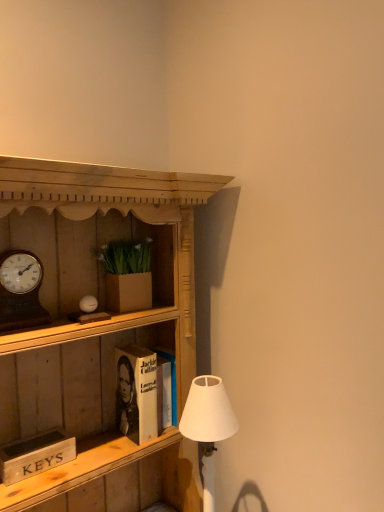
Question: Is brown cardboard box at upper center shorter than wooden cabinet at center?

Choices:
 (A) yes
 (B) no

Answer: (A)

Question: Is brown cardboard box at upper center to the left of wooden cabinet at center from the viewer's perspective?

Choices:
 (A) yes
 (B) no

Answer: (A)

Question: Is the depth of brown cardboard box at upper center greater than that of wooden cabinet at center?

Choices:
 (A) no
 (B) yes

Answer: (B)

Question: From the image's perspective, is brown cardboard box at upper center above wooden cabinet at center?

Choices:
 (A) no
 (B) yes

Answer: (B)

Question: Considering the relative positions of brown cardboard box at upper center and wooden cabinet at center in the image provided, is brown cardboard box at upper center to the right of wooden cabinet at center from the viewer's perspective?

Choices:
 (A) no
 (B) yes

Answer: (A)

Question: Based on their sizes in the image, would you say wooden signboard at lower left, the first book from the front, is bigger or smaller than white matte lampshade at lower right?

Choices:
 (A) big
 (B) small

Answer: (B)

Question: Is wooden signboard at lower left, the first book from the front, situated inside white matte lampshade at lower right or outside?

Choices:
 (A) outside
 (B) inside

Answer: (A)

Question: From their relative heights in the image, would you say wooden signboard at lower left, which is the second book from back to front, is taller or shorter than white matte lampshade at lower right?

Choices:
 (A) short
 (B) tall

Answer: (A)

Question: From the image's perspective, is wooden signboard at lower left, the first book from the front, positioned above or below white matte lampshade at lower right?

Choices:
 (A) below
 (B) above

Answer: (B)

Question: Considering the positions of hardcover book at center, the second book viewed from the left, and wooden clock at left in the image, is hardcover book at center, the second book viewed from the left, bigger or smaller than wooden clock at left?

Choices:
 (A) small
 (B) big

Answer: (B)

Question: Considering the relative positions of hardcover book at center, arranged as the second book when viewed from the front, and wooden clock at left in the image provided, is hardcover book at center, arranged as the second book when viewed from the front, to the left or to the right of wooden clock at left?

Choices:
 (A) right
 (B) left

Answer: (A)

Question: Is hardcover book at center, the 1th book when ordered from right to left, spatially inside wooden clock at left, or outside of it?

Choices:
 (A) outside
 (B) inside

Answer: (A)

Question: Is hardcover book at center, which is counted as the first book, starting from the back, wider or thinner than wooden clock at left?

Choices:
 (A) wide
 (B) thin

Answer: (A)

Question: Is wooden signboard at lower left, positioned as the 2th book in right-to-left order, in front of or behind brown cardboard box at upper center in the image?

Choices:
 (A) front
 (B) behind

Answer: (A)

Question: In terms of size, does wooden signboard at lower left, which is the second book from back to front, appear bigger or smaller than brown cardboard box at upper center?

Choices:
 (A) small
 (B) big

Answer: (A)